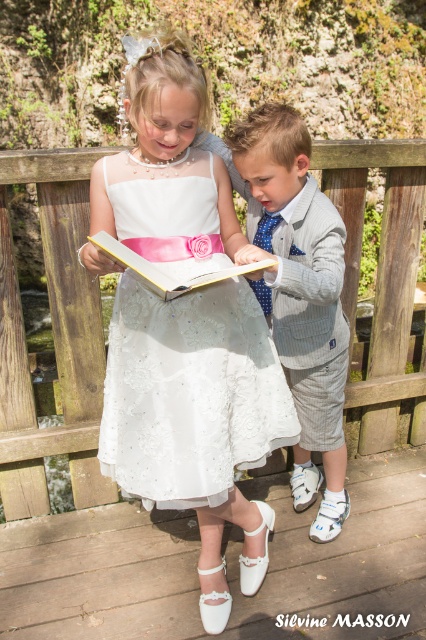
Question: Does white lace dress at center have a greater width compared to light gray pinstripe suit at center?

Choices:
 (A) yes
 (B) no

Answer: (A)

Question: Which of the following is the closest to the observer?

Choices:
 (A) (166, 284)
 (B) (273, 136)
 (C) (204, 308)

Answer: (A)

Question: Which object appears closest to the camera in this image?

Choices:
 (A) hardcover book at center
 (B) white lace dress at center

Answer: (A)

Question: Does white lace dress at center have a lesser width compared to hardcover book at center?

Choices:
 (A) no
 (B) yes

Answer: (A)

Question: Estimate the real-world distances between objects in this image. Which object is farther from the white lace dress at center?

Choices:
 (A) light gray pinstripe suit at center
 (B) hardcover book at center

Answer: (A)

Question: Does white lace dress at center appear on the right side of light gray pinstripe suit at center?

Choices:
 (A) yes
 (B) no

Answer: (B)